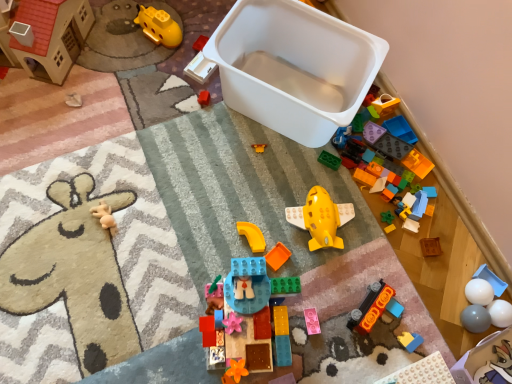
Image resolution: width=512 pixels, height=384 pixels. In order to click on free space that is in between matte plastic toy at lower right, the 5th toy viewed from the right, and translucent blue plastic building block at center, the fifth toy viewed from the left in this screenshot , I will do click(337, 337).